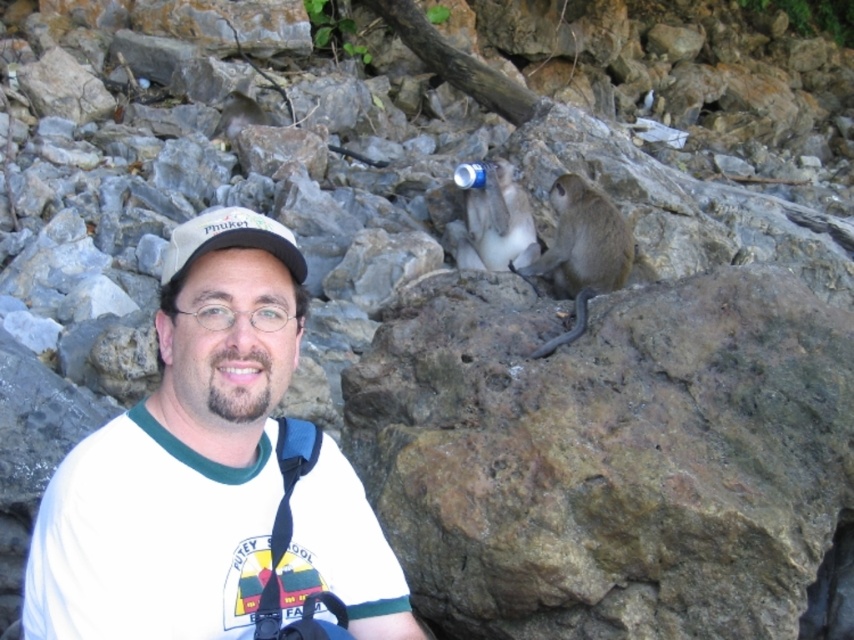
From the picture: Which of these two, white cotton shirt at left or brown furry monkey at center, stands shorter?

brown furry monkey at center is shorter.

Between white cotton shirt at left and brown furry monkey at center, which one appears on the left side from the viewer's perspective?

Positioned to the left is white cotton shirt at left.

Is point (290, 371) positioned after point (619, 232)?

No, (290, 371) is closer to viewer.

Where is `white cotton shirt at left`? The width and height of the screenshot is (854, 640). white cotton shirt at left is located at coordinates (180, 456).

Can you confirm if brown rough rock at center is positioned to the left of gray furry monkey at upper center?

No, brown rough rock at center is not to the left of gray furry monkey at upper center.

Which is below, brown rough rock at center or gray furry monkey at upper center?

Positioned lower is brown rough rock at center.

Does point (788, 557) come closer to viewer compared to point (480, 260)?

That is True.

Find the location of a particular element. Image resolution: width=854 pixels, height=640 pixels. brown rough rock at center is located at coordinates (610, 458).

Is point (492, 241) positioned before point (285, 237)?

No, it is behind (285, 237).

Describe the element at coordinates (495, 221) in the screenshot. The width and height of the screenshot is (854, 640). I see `gray furry monkey at upper center` at that location.

Find the location of `gray furry monkey at upper center`. gray furry monkey at upper center is located at coordinates pyautogui.click(x=495, y=221).